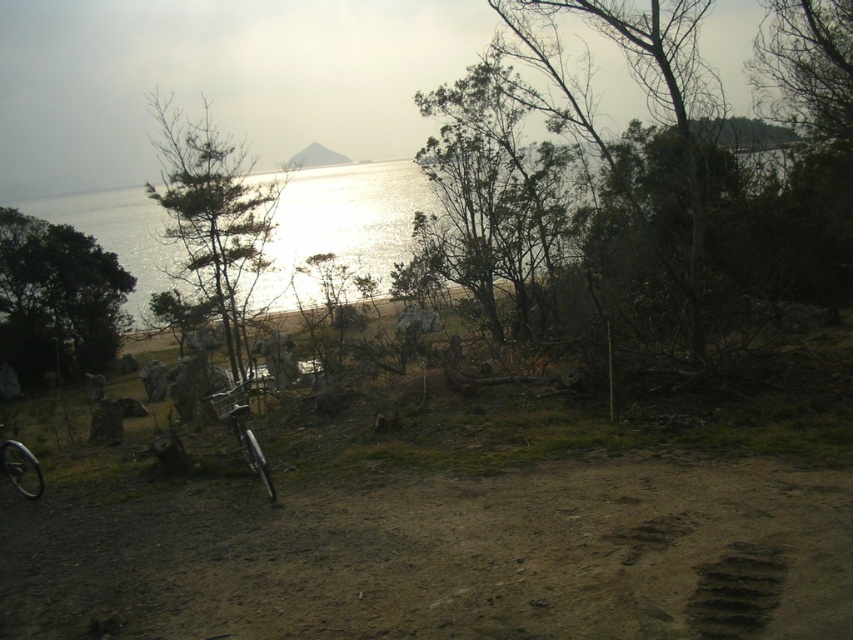
Looking at this image, you are standing at the starting point of the dirt path on the left side. You want to reach the green matte tree at center. Which direction should you move in to get there?

The green matte tree at center is located at point coordinates of [213,218], so you should move towards the center of the image from the left side dirt path to reach it.

You are planning to take a photo of the green matte tree at center and the metallic silver bicycle at center. Which object appears wider in the photo?

The green matte tree at center appears wider than the metallic silver bicycle at center because its width surpasses that of the bicycle.

You are standing on the dirt path in the coastal scene. You see a brown textured footprint at lower right and a shiny metallic bicycle wheel at lower left. Which object is nearer to you?

The brown textured footprint at lower right is closer to the viewer than the shiny metallic bicycle wheel at lower left.